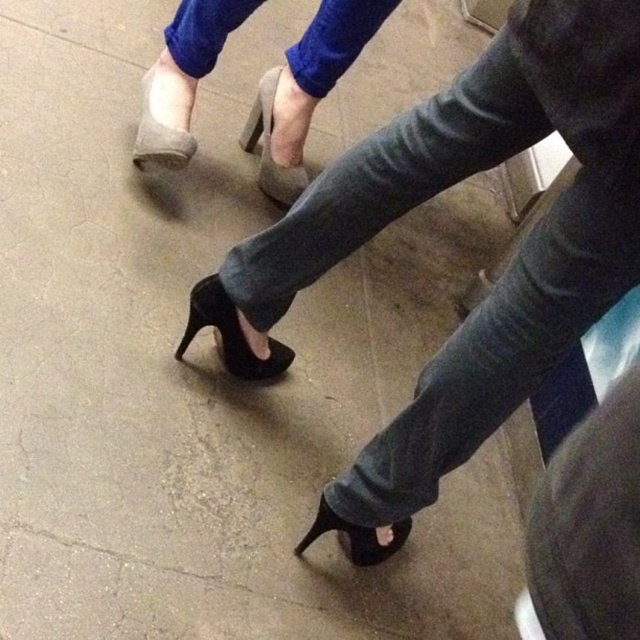
You are standing at the origin point in the image and want to move towards the blue denim jeans at upper center. Which direction should you move in terms of the coordinate system provided?

The blue denim jeans at upper center is located at point (333, 42), so you should move towards the positive x and y directions from the origin to reach it.